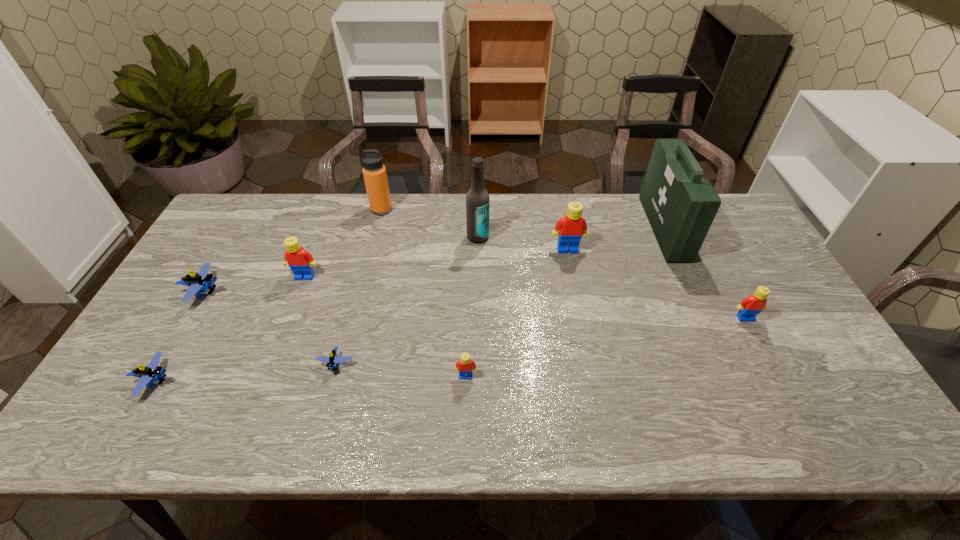
At what (x,y) coordinates should I click in order to perform the action: click on vacant area located 0.070m on the front-facing side of the ninth object from left to right. Please return your answer as a coordinate pair (x, y). Image resolution: width=960 pixels, height=540 pixels. Looking at the image, I should click on (631, 228).

Where is `free region located on the left of the thermos bottle`? The height and width of the screenshot is (540, 960). free region located on the left of the thermos bottle is located at coordinates (276, 210).

The height and width of the screenshot is (540, 960). I want to click on blank space located 0.320m on the face of the second red Lego from right to left, so click(586, 337).

Find the location of `vacant space located on the face of the third object from left to right`. vacant space located on the face of the third object from left to right is located at coordinates (289, 318).

At what (x,y) coordinates should I click in order to perform the action: click on vacant space located on the face of the rightmost Lego. Please return your answer as a coordinate pair (x, y). Image resolution: width=960 pixels, height=540 pixels. Looking at the image, I should click on (800, 420).

Where is `free space located 0.280m on the front-facing side of the farthest blue Lego`? This screenshot has width=960, height=540. free space located 0.280m on the front-facing side of the farthest blue Lego is located at coordinates (322, 292).

The width and height of the screenshot is (960, 540). Identify the location of blank area located 0.130m on the face of the third red Lego from right to left. (465, 431).

The width and height of the screenshot is (960, 540). I want to click on free region located 0.320m on the front-facing side of the second biggest blue Lego, so click(x=306, y=381).

I want to click on vacant space located on the front-facing side of the rightmost blue Lego, so click(x=319, y=433).

Locate an element on the screen. The width and height of the screenshot is (960, 540). beer bottle that is at the far edge is located at coordinates (477, 199).